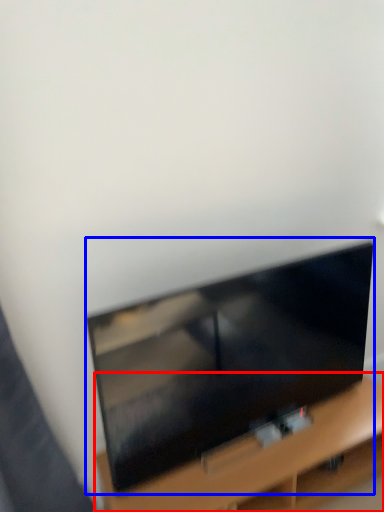
Question: Which object appears farthest to the camera in this image, furniture (highlighted by a red box) or television (highlighted by a blue box)?

Choices:
 (A) furniture
 (B) television

Answer: (A)